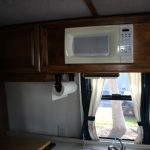
Image resolution: width=150 pixels, height=150 pixels. I want to click on ceiling, so click(x=62, y=7), click(x=105, y=9), click(x=102, y=75).